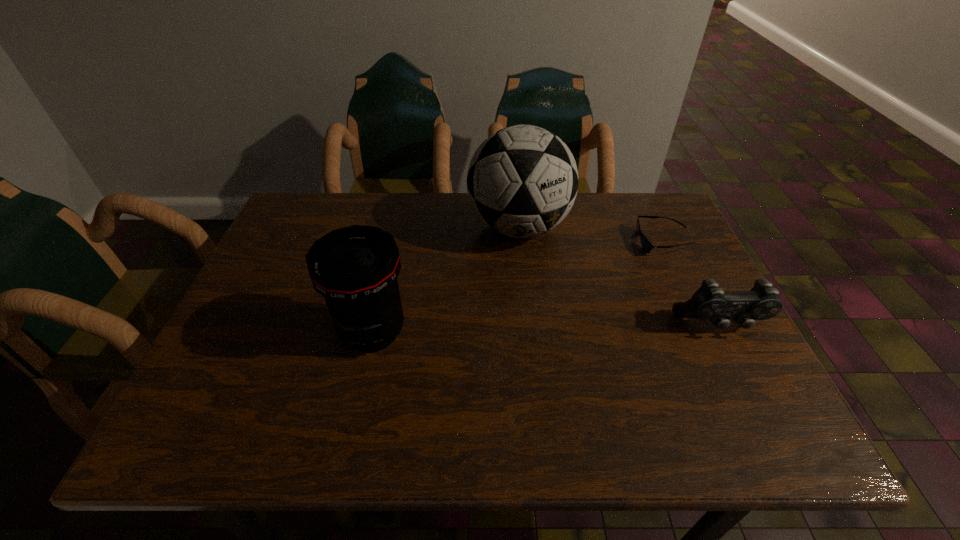
Locate an element on the screen. The image size is (960, 540). free space on the desktop that is between the third shortest object and the second shortest object and is positioned on the surface of the third object from right to left where the brand logo is visible is located at coordinates (516, 329).

Find the location of a particular element. vacant spot on the desktop that is between the second tallest object and the third tallest object and is positioned at the front of the shortest object showing the lenses is located at coordinates (516, 329).